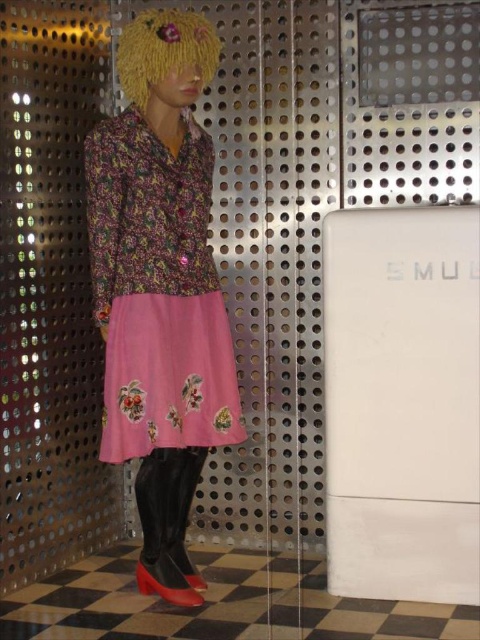
Question: Is floral-patterned fabric dress at center above blonde curly wig at upper center?

Choices:
 (A) no
 (B) yes

Answer: (A)

Question: Does shiny black leather boots at lower center appear under blonde curly wig at upper center?

Choices:
 (A) no
 (B) yes

Answer: (B)

Question: Does shiny black leather boots at lower center appear under shiny red leather shoe at lower center?

Choices:
 (A) yes
 (B) no

Answer: (B)

Question: Which of these objects is positioned closest to the matte black shoe at lower left?

Choices:
 (A) floral-patterned fabric dress at center
 (B) shiny black leather boots at lower center
 (C) blonde curly wig at upper center

Answer: (B)

Question: Which of these objects is positioned closest to the shiny black leather boots at lower center?

Choices:
 (A) blonde curly wig at upper center
 (B) matte black shoe at lower left

Answer: (B)

Question: Estimate the real-world distances between objects in this image. Which object is farther from the shiny red leather shoe at lower center?

Choices:
 (A) matte black shoe at lower left
 (B) blonde curly wig at upper center

Answer: (B)